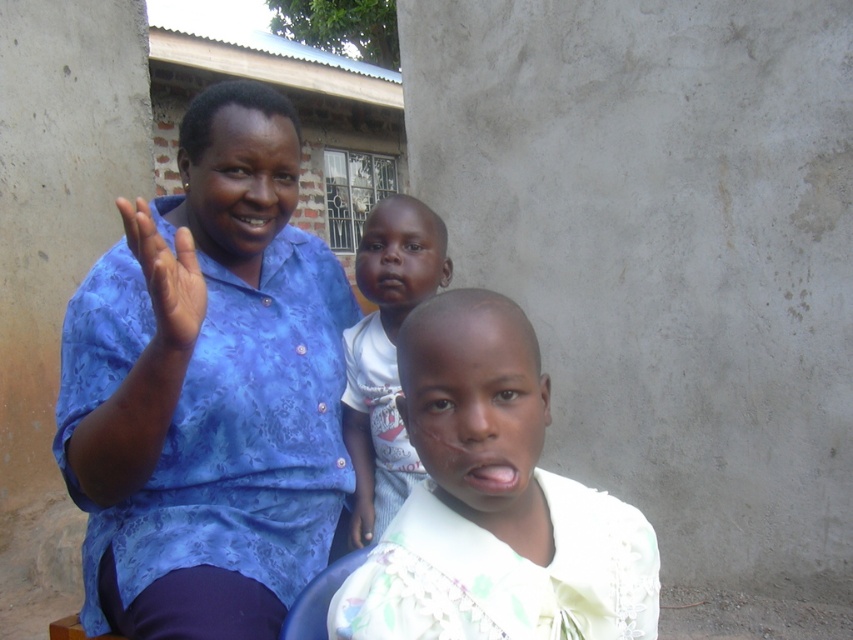
Is light beige fabric shirt at center closer to camera compared to light skin baby at center?

Yes, light beige fabric shirt at center is in front of light skin baby at center.

Can you confirm if light beige fabric shirt at center is positioned to the left of light skin baby at center?

Incorrect, light beige fabric shirt at center is not on the left side of light skin baby at center.

Locate an element on the screen. The width and height of the screenshot is (853, 640). light beige fabric shirt at center is located at coordinates (492, 502).

Does light beige fabric shirt at center have a larger size compared to blue fabric hand at left?

Indeed, light beige fabric shirt at center has a larger size compared to blue fabric hand at left.

Can you confirm if light beige fabric shirt at center is taller than blue fabric hand at left?

Indeed, light beige fabric shirt at center has a greater height compared to blue fabric hand at left.

Is point (525, 552) farther from viewer compared to point (172, 321)?

That is False.

At what (x,y) coordinates should I click in order to perform the action: click on light beige fabric shirt at center. Please return your answer as a coordinate pair (x, y). The height and width of the screenshot is (640, 853). Looking at the image, I should click on (492, 502).

Is blue printed shirt at left below blue fabric hand at left?

Yes, blue printed shirt at left is below blue fabric hand at left.

Between blue printed shirt at left and blue fabric hand at left, which one appears on the left side from the viewer's perspective?

Positioned to the left is blue printed shirt at left.

Where is `blue printed shirt at left`? This screenshot has height=640, width=853. blue printed shirt at left is located at coordinates (207, 388).